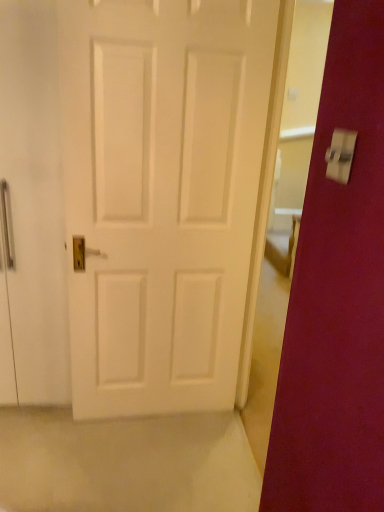
Question: Is metallic silver switch at upper right wider or thinner than white matte door at center?

Choices:
 (A) wide
 (B) thin

Answer: (B)

Question: From a real-world perspective, is metallic silver switch at upper right above or below white matte door at center?

Choices:
 (A) above
 (B) below

Answer: (A)

Question: Is metallic silver switch at upper right taller or shorter than white matte door at center?

Choices:
 (A) short
 (B) tall

Answer: (A)

Question: Would you say white matte door at center is to the left or to the right of metallic silver switch at upper right in the picture?

Choices:
 (A) left
 (B) right

Answer: (A)

Question: From the image's perspective, relative to metallic silver switch at upper right, is white matte door at center above or below?

Choices:
 (A) above
 (B) below

Answer: (B)

Question: Relative to metallic silver switch at upper right, is white matte door at center in front or behind?

Choices:
 (A) behind
 (B) front

Answer: (A)

Question: Based on their sizes in the image, would you say white matte door at center is bigger or smaller than metallic silver switch at upper right?

Choices:
 (A) small
 (B) big

Answer: (B)